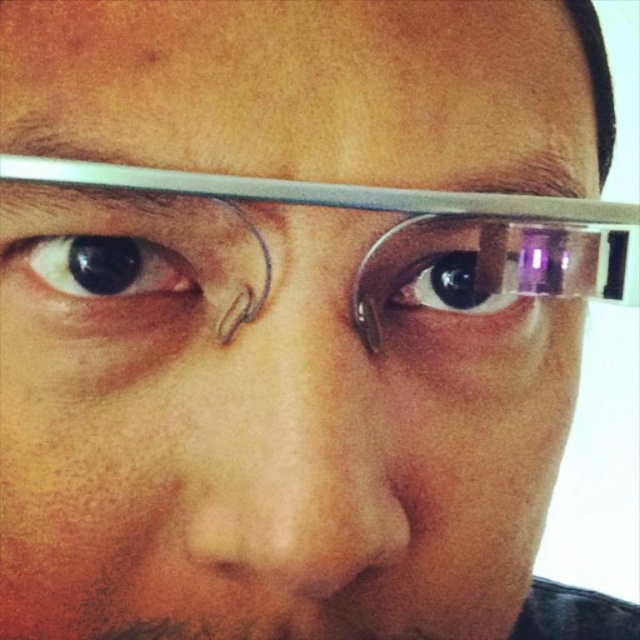
You are a makeup artist preparing to apply foundation on a client. You notice the smooth skin nose at center and the clear plastic glasses at upper center. Which object is positioned to the right side of the other?

The clear plastic glasses at upper center are positioned to the right of the smooth skin nose at center.

You are a dermatologist examining a patient. You notice the smooth skin nose at center and the clear plastic glasses at upper center. Which of these two objects is taller?

The smooth skin nose at center is much taller than the clear plastic glasses at upper center.